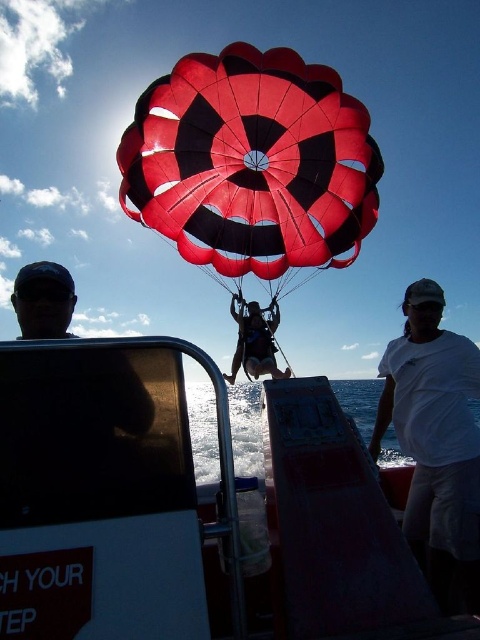
From the picture: Who is shorter, white plastic boat at center or red/black checkered parachute at center?

With less height is white plastic boat at center.

Does point (219, 404) lie behind point (233, 195)?

That is False.

Between point (127, 602) and point (356, 128), which one is positioned behind?

The point (356, 128) is more distant.

Locate an element on the screen. white plastic boat at center is located at coordinates coord(107,492).

Is the position of red/black checkered parachute at center more distant than that of matte black wetsuit at center?

That is False.

Is point (342, 243) farther from viewer compared to point (232, 372)?

No, it is in front of (232, 372).

Between point (290, 198) and point (244, 320), which one is positioned behind?

Positioned behind is point (244, 320).

In order to click on red/black checkered parachute at center in this screenshot , I will do `click(252, 163)`.

Does red/black checkered parachute at center appear over clear blue water at center?

Correct, red/black checkered parachute at center is located above clear blue water at center.

Is point (218, 67) positioned after point (197, 385)?

No, it is not.

I want to click on red/black checkered parachute at center, so click(252, 163).

The width and height of the screenshot is (480, 640). What are the coordinates of `red/black checkered parachute at center` in the screenshot? It's located at (252, 163).